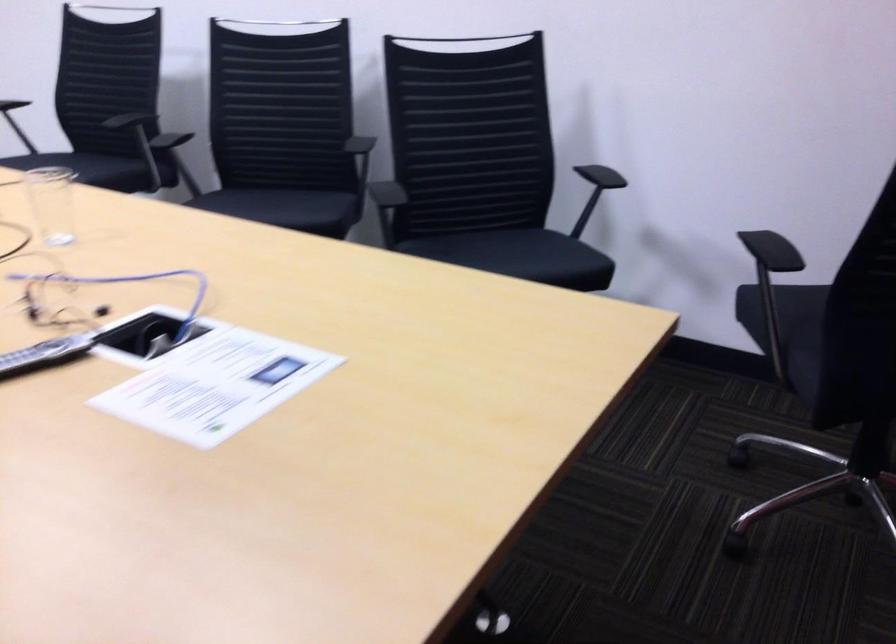
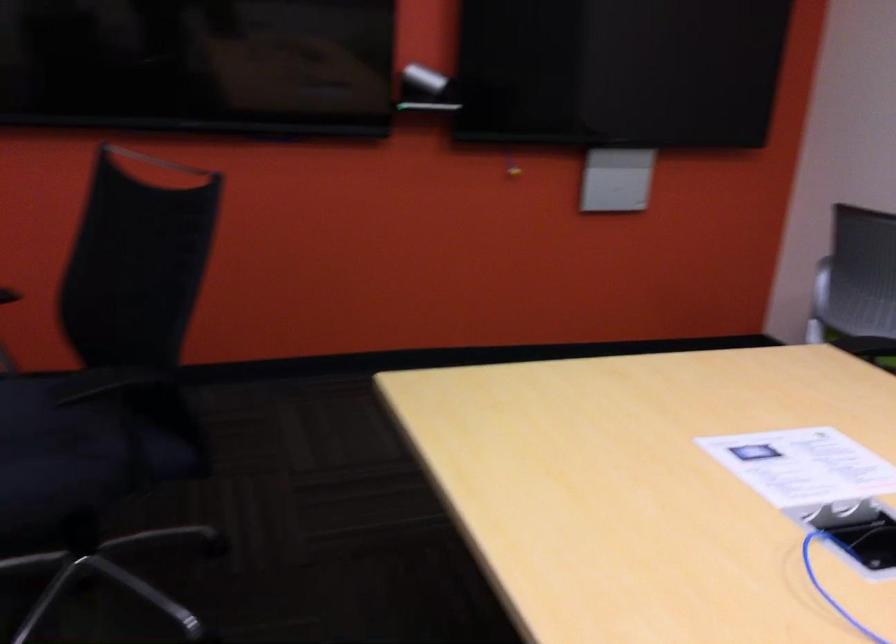
Find the pixel in the second image that matches (797,322) in the first image.

(82, 450)